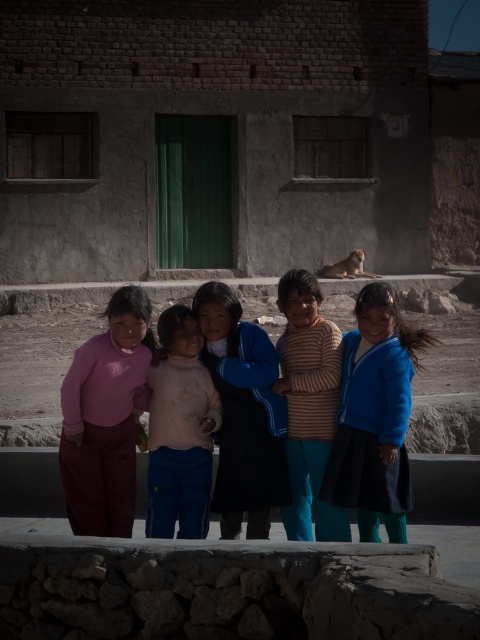
You are a photographer trying to capture both the blue woolen sweater at center and the striped knit sweater at center in a single frame. Since you want to emphasize the larger one, which sweater should you focus on to ensure it stands out more in the photo?

The blue woolen sweater at center is bigger than the striped knit sweater at center, so focusing on the blue woolen sweater at center will make it stand out more in the photo.

You are a photographer trying to capture a closeup of the blue woolen sweater at center. Based on the coordinates provided, where should you position your camera relative to the image frame?

The blue woolen sweater at center is located at coordinates point (242, 413), so you should position your camera slightly to the right and center of the image frame to capture it in focus.

You are a photographer trying to capture a photo of the children in front of the rustic building. You notice the blue matte jacket at center and the pink matte pants at left. Which object should you focus on first if you want to ensure both are in sharp focus?

The blue matte jacket at center is below the pink matte pants at left, so focusing on the pink matte pants at left first would help ensure both are in sharp focus since it is higher up and the jacket is lower, allowing for better depth of field coverage.